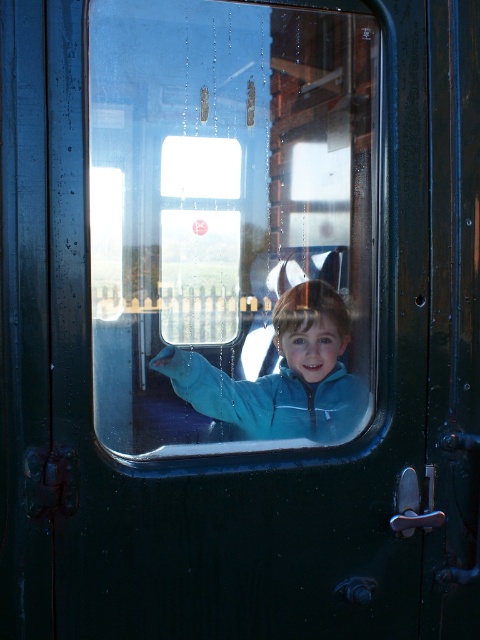
Question: Does transparent glass train window at center have a smaller size compared to blue fleece jacket at center?

Choices:
 (A) no
 (B) yes

Answer: (A)

Question: Does transparent glass train window at center appear under blue fleece jacket at center?

Choices:
 (A) yes
 (B) no

Answer: (B)

Question: Can you confirm if transparent glass train window at center is positioned to the right of blue fleece jacket at center?

Choices:
 (A) yes
 (B) no

Answer: (B)